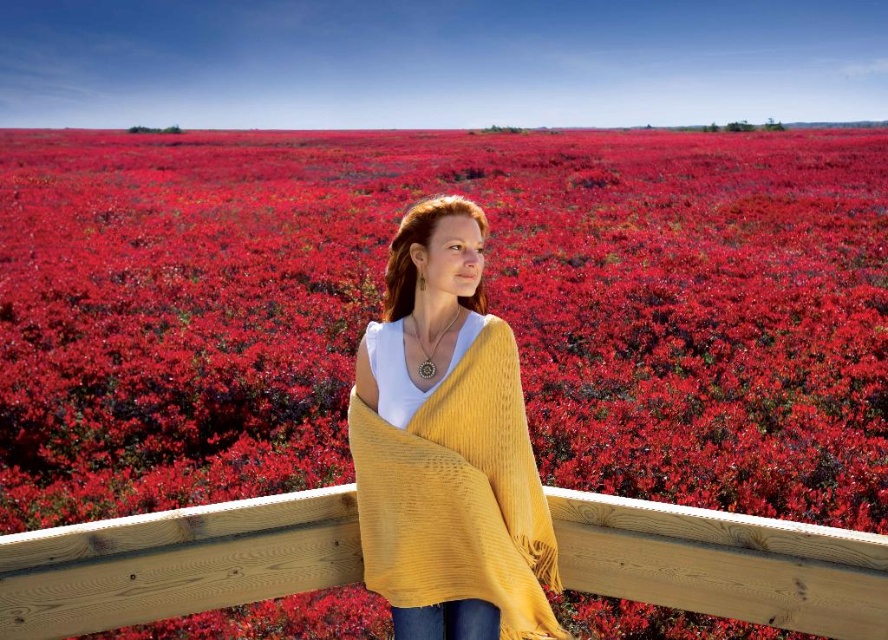
You are standing in a cranberry field and see the wooden rail at center and the mustard knit shawl at center. Which object is positioned to the left?

The wooden rail at center is to the left of mustard knit shawl at center, so the wooden rail at center is positioned to the left.

You are a photographer trying to capture the mustard knit shawl at center and the wooden rail at center in the same frame. Which object should you zoom in on to ensure both are clearly visible?

The wooden rail at center is wider than the mustard knit shawl at center, so you should zoom in on the wooden rail at center to ensure both objects are clearly visible.